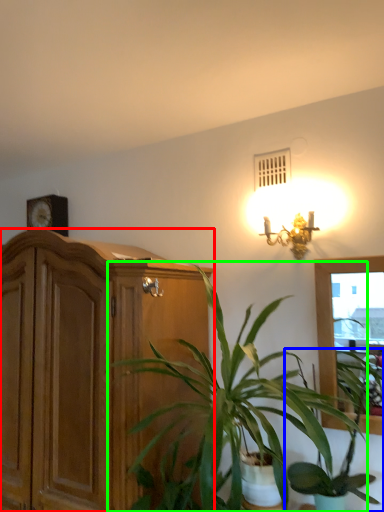
Question: Which object is the closest to the cabinetry (highlighted by a red box)? Choose among these: houseplant (highlighted by a blue box) or houseplant (highlighted by a green box).

Choices:
 (A) houseplant
 (B) houseplant

Answer: (B)